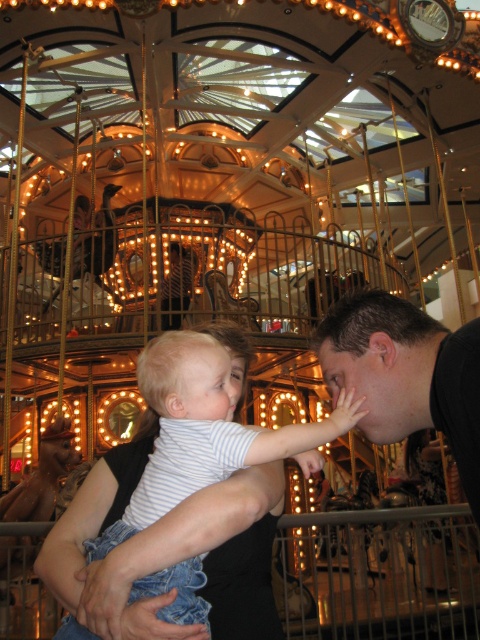
Does black matte shirt at center have a lesser height compared to striped cotton shirt at center?

Indeed, black matte shirt at center has a lesser height compared to striped cotton shirt at center.

Does point (402, 300) come behind point (265, 568)?

Yes, it is.

Which is in front, point (431, 397) or point (134, 444)?

Positioned in front is point (431, 397).

Image resolution: width=480 pixels, height=640 pixels. I want to click on black matte shirt at center, so click(406, 374).